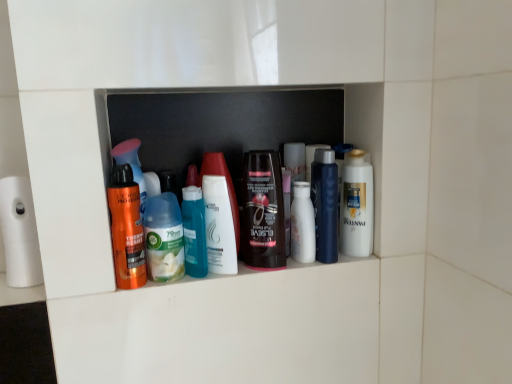
Find the location of a particular element. This screenshot has height=384, width=512. translucent plastic bottle at center, the 2th toiletry from the left is located at coordinates (194, 232).

What do you see at coordinates (226, 184) in the screenshot? The height and width of the screenshot is (384, 512). I see `white glossy lotion at center, the fourth toiletry viewed from the right` at bounding box center [226, 184].

How much space does shiny orange spray can at left, the first toiletry in the left-to-right sequence, occupy horizontally?

shiny orange spray can at left, the first toiletry in the left-to-right sequence, is 2.15 inches wide.

What do you see at coordinates (263, 211) in the screenshot?
I see `shiny brown bottle at center, placed as the 3th toiletry when sorted from right to left` at bounding box center [263, 211].

This screenshot has height=384, width=512. Find the location of `metallic blue hair spray at center, placed as the first toiletry when sorted from right to left`. metallic blue hair spray at center, placed as the first toiletry when sorted from right to left is located at coordinates (325, 204).

Identify the location of translucent plastic bottle at center, the 2th toiletry from the left. (194, 232).

Is translucent plastic bottles at center far from white glossy lotion at center, the fourth toiletry viewed from the right?

translucent plastic bottles at center is near white glossy lotion at center, the fourth toiletry viewed from the right, not far away.

Is translucent plastic bottles at center oriented towards white glossy lotion at center, the fourth toiletry viewed from the right?

Yes, translucent plastic bottles at center is aimed at white glossy lotion at center, the fourth toiletry viewed from the right.

Who is shorter, translucent plastic bottles at center or white glossy lotion at center, the fourth toiletry viewed from the right?

white glossy lotion at center, the fourth toiletry viewed from the right, is shorter.

Measure the distance between translucent plastic bottles at center and white glossy lotion at center, the third toiletry viewed from the left.

translucent plastic bottles at center is 12.22 centimeters from white glossy lotion at center, the third toiletry viewed from the left.

Would you say white glossy lotion at center, the fifth toiletry in the left-to-right sequence, is part of white glossy lotion at center, the fourth toiletry viewed from the right,'s contents?

No, white glossy lotion at center, the fifth toiletry in the left-to-right sequence, is located outside of white glossy lotion at center, the fourth toiletry viewed from the right.

From the image's perspective, which object appears higher, white glossy lotion at center, the third toiletry viewed from the left, or white glossy lotion at center, which is the second toiletry from right to left?

white glossy lotion at center, which is the second toiletry from right to left, from the image's perspective.

Does white matte toilet paper at left have a larger size compared to translucent plastic bottles at center?

Actually, white matte toilet paper at left might be smaller than translucent plastic bottles at center.

From their relative heights in the image, would you say white matte toilet paper at left is taller or shorter than translucent plastic bottles at center?

white matte toilet paper at left is shorter than translucent plastic bottles at center.

Which object is more forward, white matte toilet paper at left or translucent plastic bottles at center?

white matte toilet paper at left is more forward.

From a real-world perspective, is white matte toilet paper at left above or below translucent plastic bottles at center?

white matte toilet paper at left is situated lower than translucent plastic bottles at center in the real world.

Which is more to the left, white matte toilet paper at left or shiny brown bottle at center, placed as the 3th toiletry when sorted from right to left?

Positioned to the left is white matte toilet paper at left.

Based on the photo, would you consider white matte toilet paper at left to be distant from shiny brown bottle at center, placed as the 3th toiletry when sorted from right to left?

No, white matte toilet paper at left is not far away from shiny brown bottle at center, placed as the 3th toiletry when sorted from right to left.

Is white matte toilet paper at left inside or outside of shiny brown bottle at center, placed as the 3th toiletry when sorted from right to left?

white matte toilet paper at left lies outside shiny brown bottle at center, placed as the 3th toiletry when sorted from right to left.

Considering the positions of point (155, 246) and point (33, 262), is point (155, 246) closer or farther from the camera than point (33, 262)?

Point (155, 246) appears to be closer to the viewer than point (33, 262).

Consider the image. Is white glossy body wash at center thinner than white matte toilet paper at left?

Indeed, white glossy body wash at center has a lesser width compared to white matte toilet paper at left.

Is white matte toilet paper at left at the back of white glossy body wash at center?

No, white glossy body wash at center is not facing the opposite direction of white matte toilet paper at left.

Looking at this image, is metallic blue hair spray at center, acting as the 6th toiletry starting from the left, facing away from white glossy lotion at center, the fifth toiletry in the left-to-right sequence?

metallic blue hair spray at center, acting as the 6th toiletry starting from the left, is not turned away from white glossy lotion at center, the fifth toiletry in the left-to-right sequence.

Is metallic blue hair spray at center, placed as the first toiletry when sorted from right to left, closer to camera compared to white glossy lotion at center, the fifth toiletry in the left-to-right sequence?

Yes.

From the image's perspective, is metallic blue hair spray at center, acting as the 6th toiletry starting from the left, positioned above or below white glossy lotion at center, which is the second toiletry from right to left?

metallic blue hair spray at center, acting as the 6th toiletry starting from the left, is above white glossy lotion at center, which is the second toiletry from right to left.

Is shiny orange spray can at left, the first toiletry in the left-to-right sequence, at the back of white glossy body wash at center?

No, shiny orange spray can at left, the first toiletry in the left-to-right sequence, is not at the back of white glossy body wash at center.

Between white glossy body wash at center and shiny orange spray can at left, which is the sixth toiletry in right-to-left order, which one has less height?

With less height is white glossy body wash at center.

Considering the relative positions of white glossy body wash at center and shiny orange spray can at left, which is the sixth toiletry in right-to-left order, in the image provided, is white glossy body wash at center to the left of shiny orange spray can at left, which is the sixth toiletry in right-to-left order, from the viewer's perspective?

In fact, white glossy body wash at center is to the right of shiny orange spray can at left, which is the sixth toiletry in right-to-left order.

Is white glossy body wash at center wider or thinner than shiny orange spray can at left, which is the sixth toiletry in right-to-left order?

Considering their sizes, white glossy body wash at center looks broader than shiny orange spray can at left, which is the sixth toiletry in right-to-left order.

From the image's perspective, count 4th toiletrys downward from the translucent plastic bottles at center and point to it. Please provide its 2D coordinates.

[(226, 184)]

You are a GUI agent. You are given a task and a screenshot of the screen. Output one action in this format:
    pyautogui.click(x=<x>, y=<y>)
    Task: Click on the toiletry that is the 2nd object to the left of the white glossy lotion at center, the fifth toiletry in the left-to-right sequence, starting at the anchor
    
    Given the screenshot: What is the action you would take?
    pyautogui.click(x=226, y=184)

Which object lies further to the anchor point white glossy mouthwash at center right, shiny brown bottle at center, placed as the 3th toiletry when sorted from right to left, or metallic blue hair spray at center, placed as the first toiletry when sorted from right to left?

Among the two, shiny brown bottle at center, placed as the 3th toiletry when sorted from right to left, is located further to white glossy mouthwash at center right.

Looking at the image, which one is located closer to white glossy lotion at center, the fourth toiletry viewed from the right, metallic blue hair spray at center, placed as the first toiletry when sorted from right to left, or white glossy mouthwash at center right?

metallic blue hair spray at center, placed as the first toiletry when sorted from right to left, is positioned closer to the anchor white glossy lotion at center, the fourth toiletry viewed from the right.

From the image, which object appears to be farther from white glossy mouthwash at center right, white glossy lotion at center, which is the second toiletry from right to left, or translucent plastic bottle at center, the 5th toiletry when ordered from right to left?

translucent plastic bottle at center, the 5th toiletry when ordered from right to left.

Looking at the image, which one is located further to white glossy body wash at center, white glossy lotion at center, which is the second toiletry from right to left, or translucent plastic bottle at center, the 5th toiletry when ordered from right to left?

white glossy lotion at center, which is the second toiletry from right to left, is positioned further to the anchor white glossy body wash at center.

Considering their positions, is shiny orange spray can at left, which is the sixth toiletry in right-to-left order, positioned further to metallic blue hair spray at center, placed as the first toiletry when sorted from right to left, than shiny brown bottle at center, placed as the 3th toiletry when sorted from right to left?

shiny orange spray can at left, which is the sixth toiletry in right-to-left order, is further to metallic blue hair spray at center, placed as the first toiletry when sorted from right to left.

When comparing their distances from translucent plastic bottle at center, the 2th toiletry from the left, does white glossy lotion at center, the third toiletry viewed from the left, or white glossy lotion at center, which is the second toiletry from right to left, seem further?

The object further to translucent plastic bottle at center, the 2th toiletry from the left, is white glossy lotion at center, which is the second toiletry from right to left.

When comparing their distances from white glossy mouthwash at center right, does translucent plastic bottles at center or shiny orange spray can at left, which is the sixth toiletry in right-to-left order, seem further?

Based on the image, shiny orange spray can at left, which is the sixth toiletry in right-to-left order, appears to be further to white glossy mouthwash at center right.

Consider the image. Looking at the image, which one is located further to metallic blue hair spray at center, placed as the first toiletry when sorted from right to left, white glossy mouthwash at center right or shiny brown bottle at center, placed as the 3th toiletry when sorted from right to left?

The object further to metallic blue hair spray at center, placed as the first toiletry when sorted from right to left, is shiny brown bottle at center, placed as the 3th toiletry when sorted from right to left.

At what (x,y) coordinates should I click in order to perform the action: click on toiletry between shiny brown bottle at center, the fourth toiletry from the left, and metallic blue hair spray at center, acting as the 6th toiletry starting from the left, in the horizontal direction. Please return your answer as a coordinate pair (x, y). The height and width of the screenshot is (384, 512). Looking at the image, I should click on (302, 224).

This screenshot has width=512, height=384. I want to click on shelf located between white glossy body wash at center and white glossy lotion at center, which is the second toiletry from right to left, in the left-right direction, so click(x=222, y=124).

In order to click on bottle located between white matte toilet paper at left and white glossy lotion at center, the fourth toiletry viewed from the right, in the left-right direction in this screenshot , I will do `click(164, 238)`.

The height and width of the screenshot is (384, 512). Find the location of `toiletry located between translucent plastic bottle at center, the 2th toiletry from the left, and shiny brown bottle at center, the fourth toiletry from the left, in the left-right direction`. toiletry located between translucent plastic bottle at center, the 2th toiletry from the left, and shiny brown bottle at center, the fourth toiletry from the left, in the left-right direction is located at coordinates (226, 184).